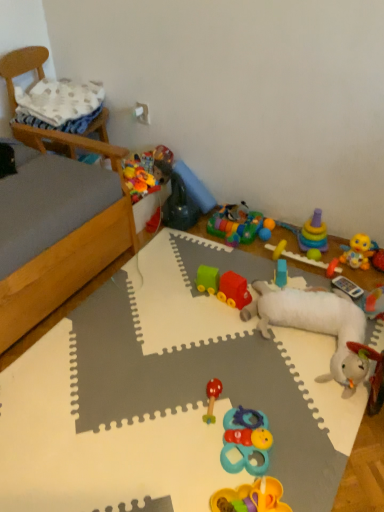
This screenshot has height=512, width=384. In order to click on free space in front of rubberized red mushroom at center, which is counted as the 2th toy, starting from the bottom in this screenshot , I will do `click(198, 456)`.